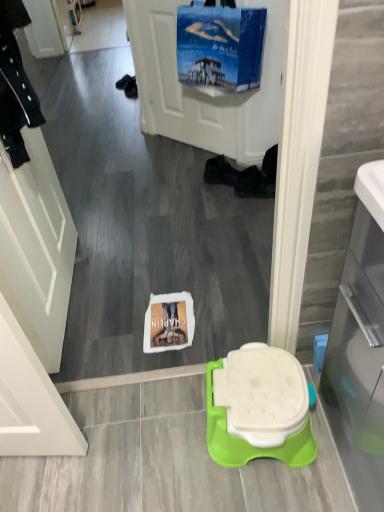
The image size is (384, 512). I want to click on vacant space in front of white plastic toilet at center, so click(x=253, y=481).